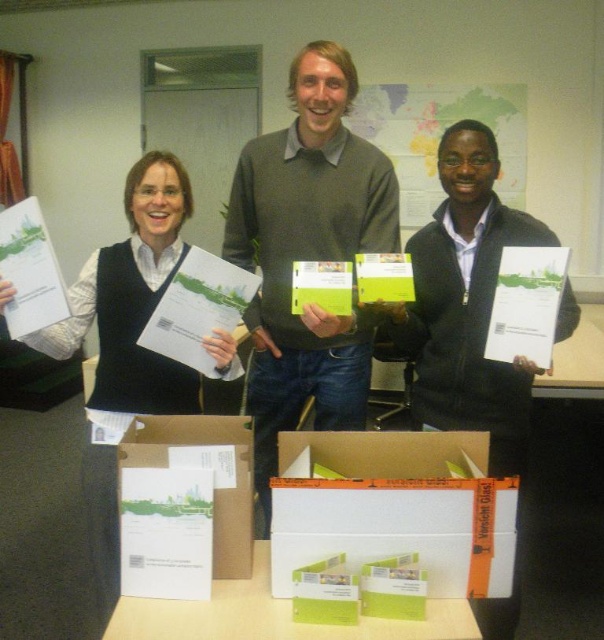
Is white cardboard box at lower center bigger than white paper at center?

Yes.

Does white cardboard box at lower center appear on the left side of white paper at center?

Incorrect, white cardboard box at lower center is not on the left side of white paper at center.

You are a GUI agent. You are given a task and a screenshot of the screen. Output one action in this format:
    pyautogui.click(x=<x>, y=<y>)
    Task: Click on the white cardboard box at lower center
    This screenshot has height=640, width=604.
    Given the screenshot: What is the action you would take?
    pyautogui.click(x=378, y=502)

The width and height of the screenshot is (604, 640). What do you see at coordinates (132, 301) in the screenshot?
I see `matte black vest at center` at bounding box center [132, 301].

Between matte black vest at center and map paper at center, which one is positioned lower?

matte black vest at center is below.

Is point (161, 266) positioned in front of point (454, 115)?

Yes, point (161, 266) is in front of point (454, 115).

Image resolution: width=604 pixels, height=640 pixels. I want to click on matte black vest at center, so click(132, 301).

Is white cardboard box at center above white paper at center?

Yes, white cardboard box at center is above white paper at center.

Identify the location of white cardboard box at center. This screenshot has width=604, height=640. pyautogui.click(x=184, y=504).

Locate an element on the screen. white cardboard box at center is located at coordinates (184, 504).